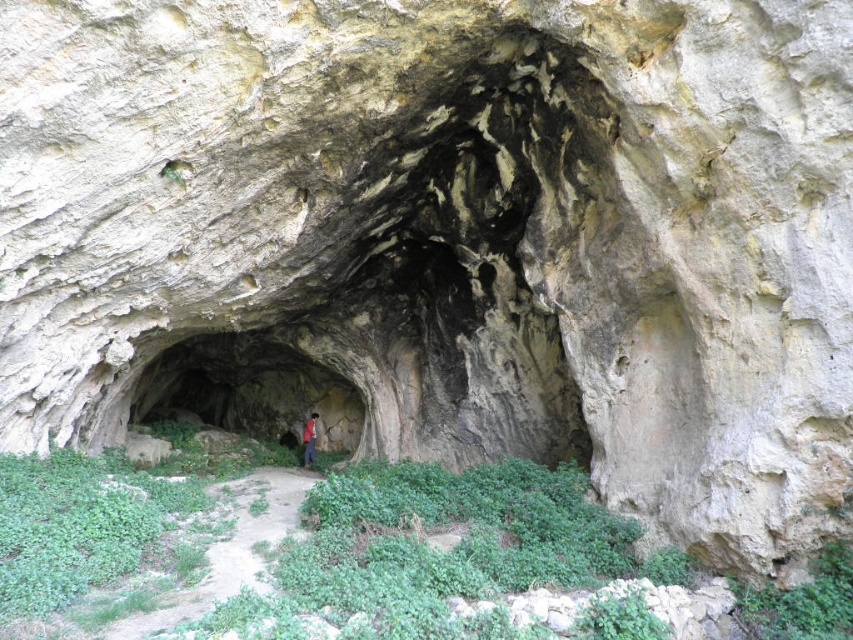
Question: Considering the relative positions of green mossy cave at center and red fabric person at center in the image provided, where is green mossy cave at center located with respect to red fabric person at center?

Choices:
 (A) right
 (B) left

Answer: (A)

Question: Which point is farther to the camera?

Choices:
 (A) red fabric person at center
 (B) green mossy cave at center

Answer: (B)

Question: Which point is closer to the camera taking this photo?

Choices:
 (A) (312, 419)
 (B) (263, 410)

Answer: (A)

Question: Is green mossy cave at center behind red fabric person at center?

Choices:
 (A) no
 (B) yes

Answer: (B)

Question: Is green mossy cave at center bigger than red fabric person at center?

Choices:
 (A) no
 (B) yes

Answer: (A)